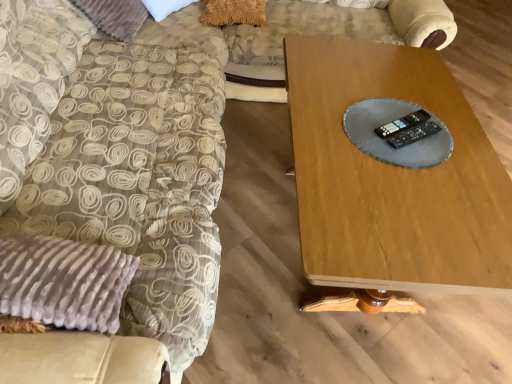
This screenshot has height=384, width=512. I want to click on vacant space in front of black plastic remote at center, which appears as the second control when ordered from the bottom, so click(409, 163).